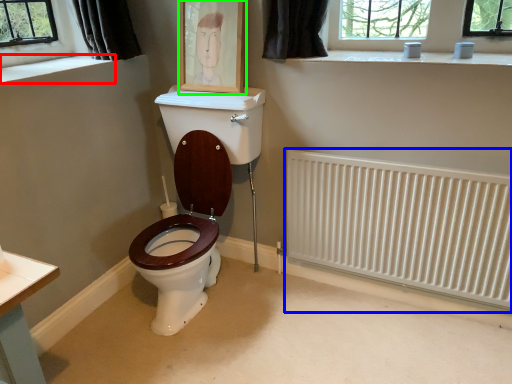
Question: Based on their relative distances, which object is nearer to window sill (highlighted by a red box)? Choose from radiator (highlighted by a blue box) and picture frame (highlighted by a green box).

Choices:
 (A) radiator
 (B) picture frame

Answer: (B)